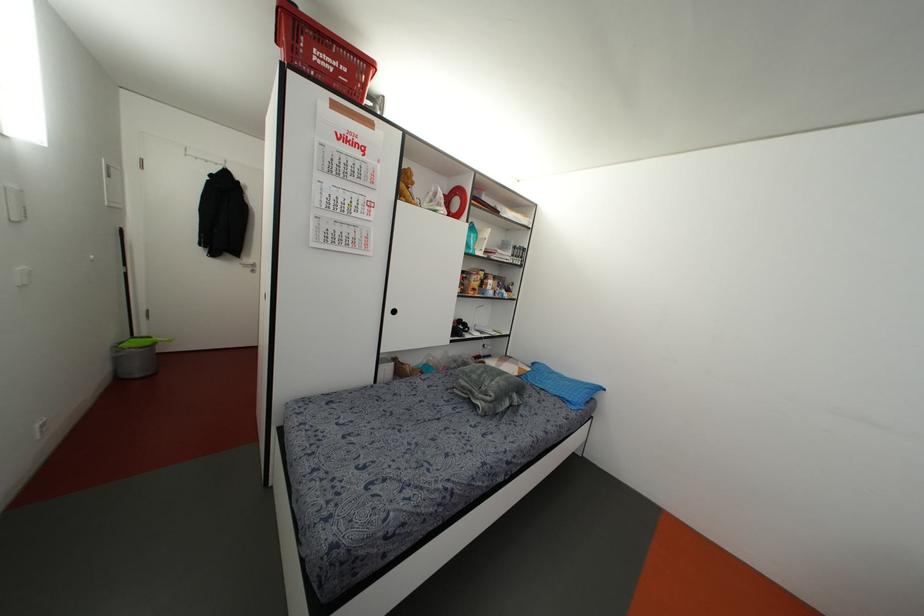
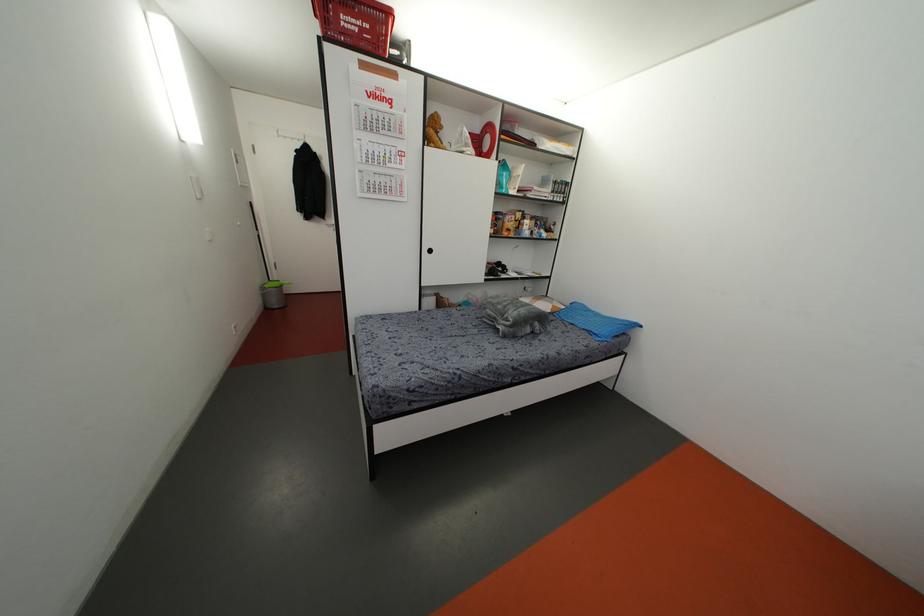
Where in the second image is the point corresponding to point (469, 251) from the first image?

(503, 191)